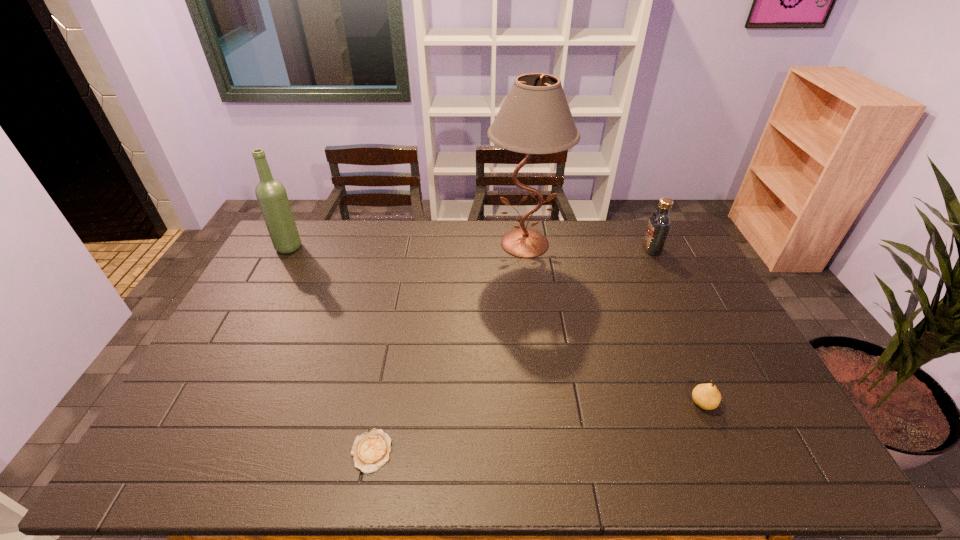
Image resolution: width=960 pixels, height=540 pixels. What are the coordinates of `vacant space located on the front of the second tallest object` in the screenshot? It's located at (268, 286).

The width and height of the screenshot is (960, 540). I want to click on vacant region located on the front-facing side of the third tallest object, so click(x=612, y=249).

What are the coordinates of `vacant space located 0.070m on the front-facing side of the third tallest object` in the screenshot? It's located at (625, 249).

Where is `free space located 0.300m on the front-facing side of the third tallest object`? This screenshot has height=540, width=960. free space located 0.300m on the front-facing side of the third tallest object is located at coordinates (564, 249).

Find the location of a particular element. vacant space positioned on the left of the fourth tallest object is located at coordinates (613, 403).

Locate an element on the screen. This screenshot has height=540, width=960. vacant space situated 0.340m on the left of the second object from left to right is located at coordinates (209, 451).

The width and height of the screenshot is (960, 540). What are the coordinates of `table lamp present at the far edge` in the screenshot? It's located at (535, 118).

The height and width of the screenshot is (540, 960). I want to click on wine bottle situated at the far edge, so [271, 194].

I want to click on vodka that is positioned at the far edge, so tap(659, 224).

Locate an element on the screen. object present at the near edge is located at coordinates (370, 451).